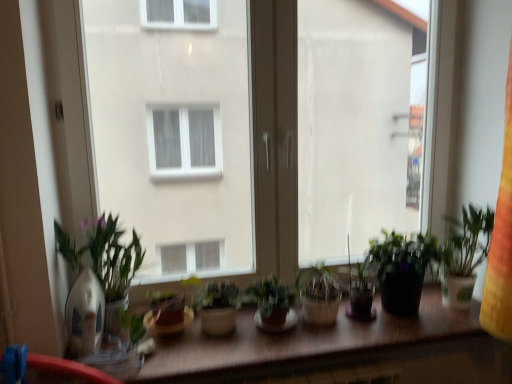
The width and height of the screenshot is (512, 384). Find the location of `vacant region under translucent plastic pot at center, acting as the 4th houseplant starting from the left (from a real-world perspective)`. vacant region under translucent plastic pot at center, acting as the 4th houseplant starting from the left (from a real-world perspective) is located at coordinates (409, 313).